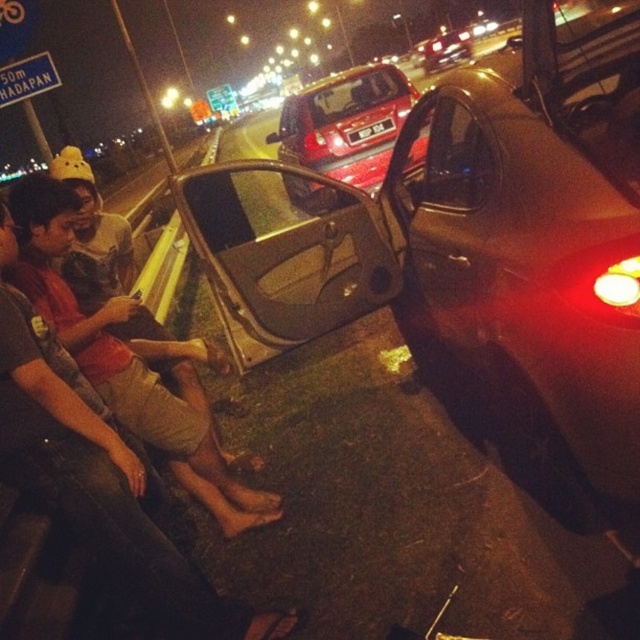
Question: Among these objects, which one is nearest to the camera?

Choices:
 (A) metallic silver car at center
 (B) shiny red car at center
 (C) matte red shirt at lower left
 (D) glossy red car at center

Answer: (C)

Question: Is blue plastic sign at upper left positioned behind glossy red car at center?

Choices:
 (A) no
 (B) yes

Answer: (A)

Question: Which of the following is the closest to the observer?

Choices:
 (A) (461, 36)
 (B) (100, 308)

Answer: (B)

Question: Estimate the real-world distances between objects in this image. Which object is closer to the blue plastic sign at upper left?

Choices:
 (A) shiny red car at center
 (B) matte red shirt at lower left

Answer: (B)

Question: Does shiny red car at center appear over glossy red car at center?

Choices:
 (A) yes
 (B) no

Answer: (B)

Question: Is blue plastic sign at upper left smaller than glossy red car at center?

Choices:
 (A) yes
 (B) no

Answer: (A)